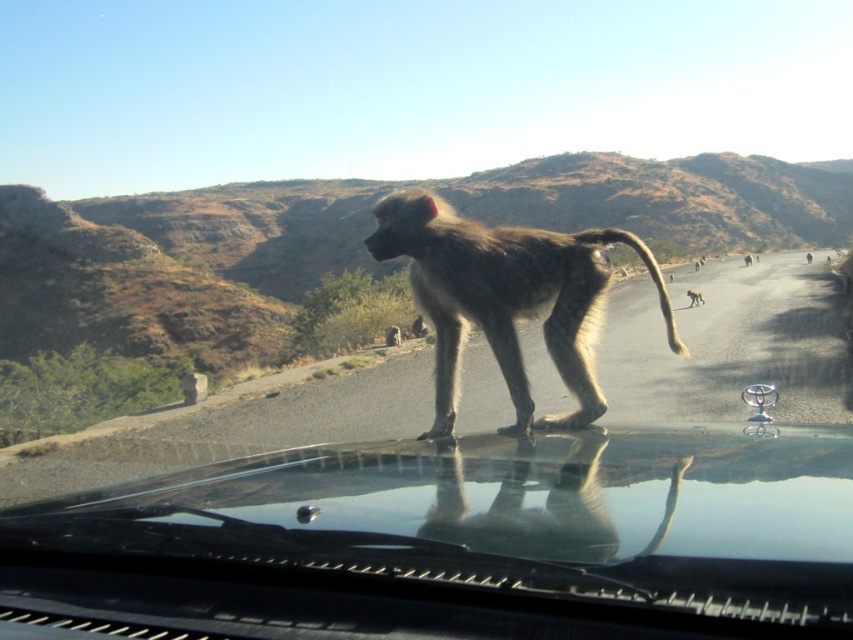
You are a passenger in the car and want to take a photo of the fuzzy brown monkey at center through the transparent glass windshield at center. Will the entire monkey fit in the frame if the windshield is the width of the camera view?

The transparent glass windshield at center might be wider than fuzzy brown monkey at center, so there is a possibility that the entire monkey could fit within the windshield width. However, the exact fit depends on the monkey and windshield dimensions.

You are driving a car and notice the transparent glass windshield at center and the fuzzy brown monkey at center. Which object is taller from your viewpoint?

The fuzzy brown monkey at center is taller than the transparent glass windshield at center.